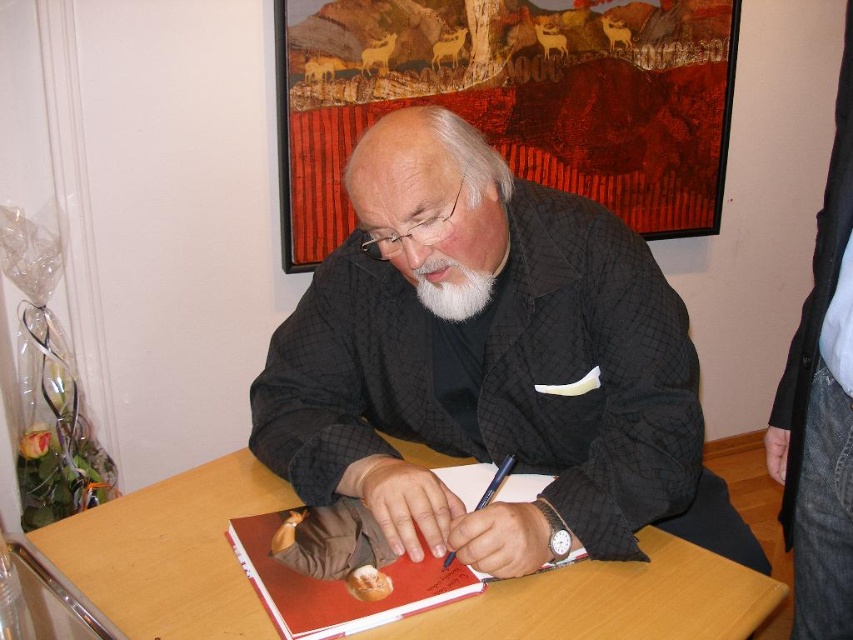
Is the position of white fuzzy beard at center more distant than that of blue metallic pen at center?

Yes, white fuzzy beard at center is further from the viewer.

Does white fuzzy beard at center appear on the left side of blue metallic pen at center?

Yes, white fuzzy beard at center is to the left of blue metallic pen at center.

Does point (425, 300) lie in front of point (494, 472)?

Yes, it is in front of point (494, 472).

The height and width of the screenshot is (640, 853). Find the location of `white fuzzy beard at center`. white fuzzy beard at center is located at coordinates (451, 289).

Does black textured jacket at center have a greater width compared to wooden table at center?

No.

Which is above, black textured jacket at center or wooden table at center?

black textured jacket at center

Is point (341, 378) more distant than point (238, 454)?

No, (341, 378) is in front of (238, 454).

Image resolution: width=853 pixels, height=640 pixels. In order to click on black textured jacket at center in this screenshot , I will do `click(483, 358)`.

Measure the distance between red matte notebook at center and camera.

red matte notebook at center is 31.50 inches from camera.

Which of these two, red matte notebook at center or white fuzzy beard at center, stands taller?

red matte notebook at center is taller.

What do you see at coordinates (339, 586) in the screenshot? The width and height of the screenshot is (853, 640). I see `red matte notebook at center` at bounding box center [339, 586].

This screenshot has width=853, height=640. I want to click on red matte notebook at center, so click(339, 586).